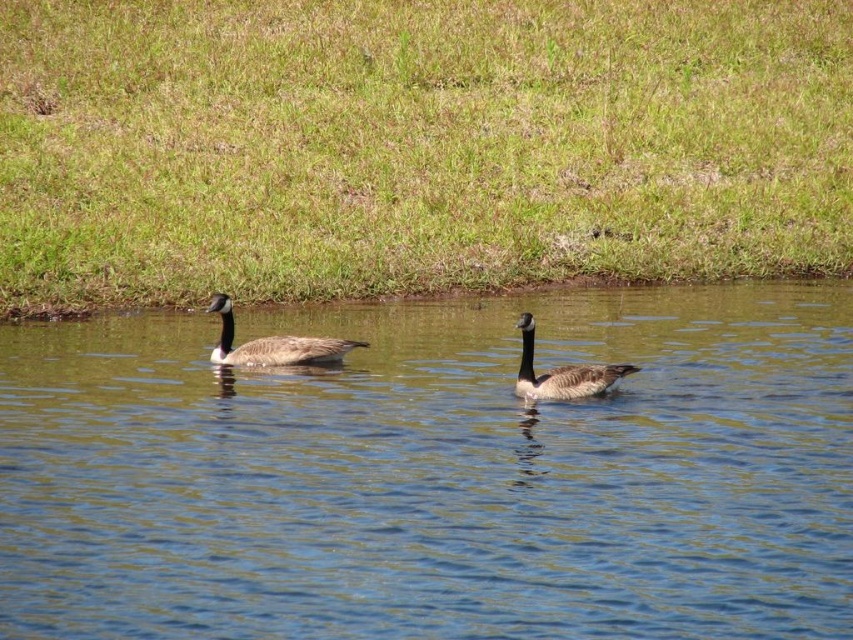
Question: Which of these objects is positioned farthest from the green grass at center?

Choices:
 (A) brown speckled duck at center
 (B) dark gray feathers at center

Answer: (B)

Question: Is green grass at center smaller than dark gray feathers at center?

Choices:
 (A) no
 (B) yes

Answer: (A)

Question: Which point is closer to the camera taking this photo?

Choices:
 (A) (502, 83)
 (B) (653, 312)
 (C) (624, 369)
 (D) (344, 353)

Answer: (C)

Question: Estimate the real-world distances between objects in this image. Which object is farther from the clear blue water at center?

Choices:
 (A) green grass at center
 (B) brown speckled duck at center
 (C) dark gray feathers at center

Answer: (A)

Question: Is green grass at center above brown speckled duck at center?

Choices:
 (A) yes
 (B) no

Answer: (A)

Question: Does clear blue water at center have a lesser width compared to green grass at center?

Choices:
 (A) no
 (B) yes

Answer: (B)